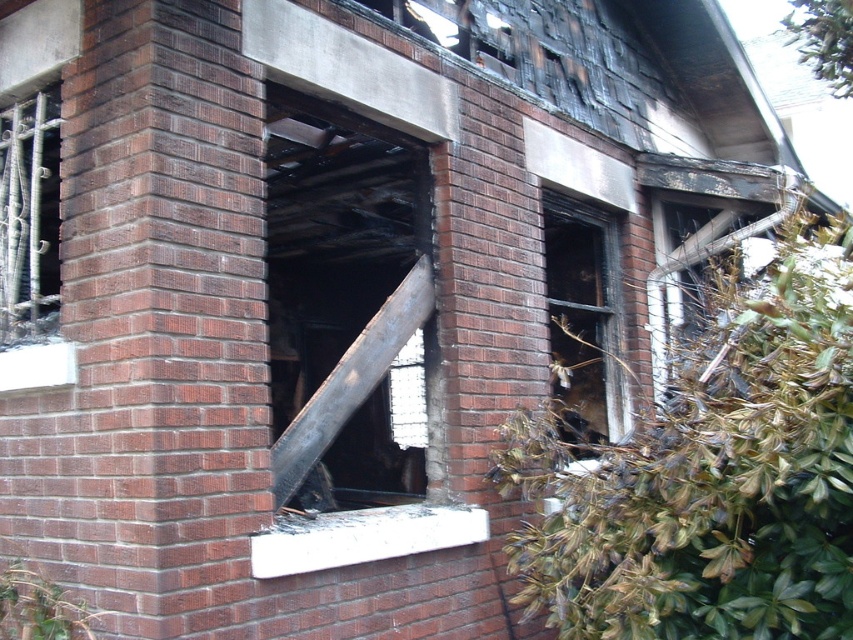
In the scene shown: You are a firefighter assessing the damage to the brick building. You need to determine which window to prioritize for ventilation. The black glass window at center and the charcoal wood window at right are both damaged. Based on their sizes, which window should you choose?

The black glass window at center is bigger than the charcoal wood window at right, so you should prioritize the black glass window at center for ventilation as it can provide more airflow.

You are a drone operator assessing the damage to the building. You need to fly the drone from point A to point B. The coordinates for point A are point (x=381, y=305) and point B are point (x=589, y=419). Based on the image, will the drone have to ascend or descend to move from A to B?

The drone will have to descend to move from point A to point B because point A is further to the camera than point B, meaning it is higher in elevation.

You are a firefighter assessing the damaged building. You need to check both the black glass window at center and the charcoal wood window at right. Which window should you approach first based on their positions?

The black glass window at center is closer to the viewer than the charcoal wood window at right, so you should approach the black glass window at center first.